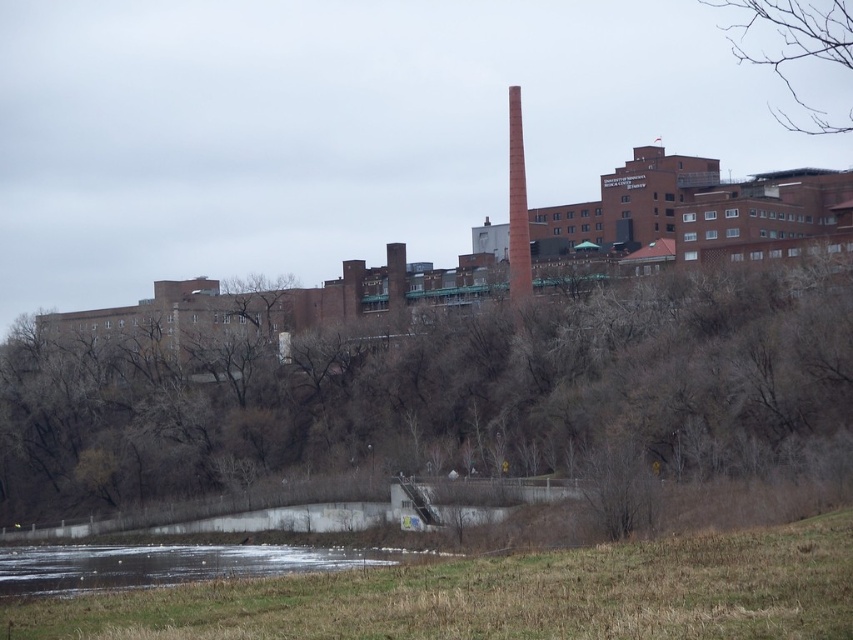
This screenshot has width=853, height=640. What do you see at coordinates (442, 394) in the screenshot?
I see `brown leafless trees at upper center` at bounding box center [442, 394].

How distant is brown leafless trees at upper center from red brick chimney at upper right?

brown leafless trees at upper center is 30.09 meters away from red brick chimney at upper right.

Image resolution: width=853 pixels, height=640 pixels. What do you see at coordinates (442, 394) in the screenshot?
I see `brown leafless trees at upper center` at bounding box center [442, 394].

The height and width of the screenshot is (640, 853). I want to click on brown leafless trees at upper center, so click(x=442, y=394).

Is bare branches at upper right bigger than red brick chimney at upper right?

Indeed, bare branches at upper right has a larger size compared to red brick chimney at upper right.

Is bare branches at upper right further to the viewer compared to red brick chimney at upper right?

Yes.

Which is in front, point (750, 48) or point (521, 256)?

Positioned in front is point (521, 256).

At what (x,y) coordinates should I click in order to perform the action: click on bare branches at upper right. Please return your answer as a coordinate pair (x, y). The image size is (853, 640). Looking at the image, I should click on (793, 49).

The height and width of the screenshot is (640, 853). I want to click on brown leafless trees at upper center, so click(x=442, y=394).

Where is `brown leafless trees at upper center`? The width and height of the screenshot is (853, 640). brown leafless trees at upper center is located at coordinates (442, 394).